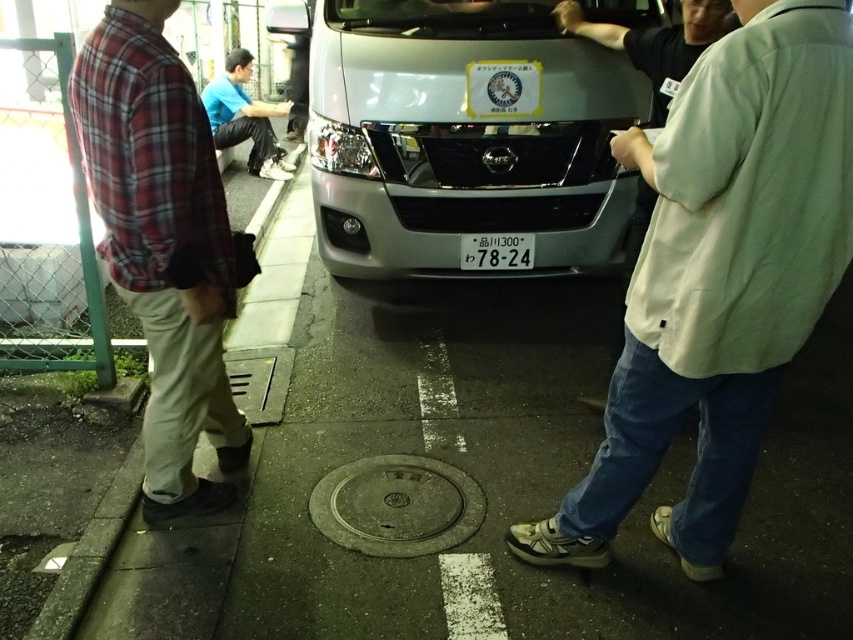
Which is behind, point (428, 486) or point (483, 236)?

Positioned behind is point (483, 236).

Is gray metallic manhole cover at center thinner than white plastic license plate at center?

In fact, gray metallic manhole cover at center might be wider than white plastic license plate at center.

Is point (350, 531) positioned before point (508, 253)?

Yes, it is.

What are the coordinates of `gray metallic manhole cover at center` in the screenshot? It's located at [x=397, y=506].

Which is more to the left, gray concrete curb at left or blue cotton shirt at lower left?

Positioned to the left is blue cotton shirt at lower left.

Who is higher up, gray concrete curb at left or blue cotton shirt at lower left?

blue cotton shirt at lower left is above.

Does point (33, 621) come farther from viewer compared to point (235, 132)?

No, it is not.

You are a GUI agent. You are given a task and a screenshot of the screen. Output one action in this format:
    pyautogui.click(x=<x>, y=<y>)
    Task: Click on the gray concrete curb at left
    The image size is (853, 640).
    Given the screenshot: What is the action you would take?
    pyautogui.click(x=88, y=556)

Can you confirm if gray metallic manhole cover at center is positioned to the right of gray concrete curb at left?

Indeed, gray metallic manhole cover at center is positioned on the right side of gray concrete curb at left.

Where is `gray metallic manhole cover at center`? This screenshot has width=853, height=640. gray metallic manhole cover at center is located at coordinates (397, 506).

Locate an element on the screen. Image resolution: width=853 pixels, height=640 pixels. gray metallic manhole cover at center is located at coordinates (397, 506).